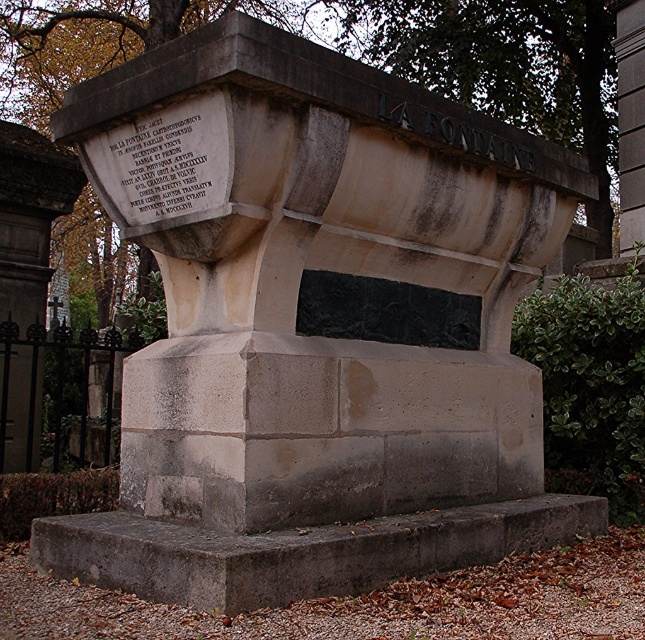
You are standing in front of the gray stone monument at center and the black stone inscription at upper left. Which object is positioned to the left?

The black stone inscription at upper left is positioned to the left of the gray stone monument at center.

You are a visitor at the cemetery and want to take a photo of both the gray stone monument at center and the brown stone sign at upper center. Which object should you focus on first to ensure both are in the frame?

You should focus on the gray stone monument at center first since it is located below the brown stone sign at upper center, ensuring both are within the camera frame by centering the monument and adjusting the angle to include the sign above it.

You are standing in front of the stone monument and notice two points marked on the monument. The first point is at coordinates point (446, 120) and the second is at point (450, 45). From your perspective, which point is closer to you?

Point (446, 120) is in front of point (450, 45), so the first point is closer to you.